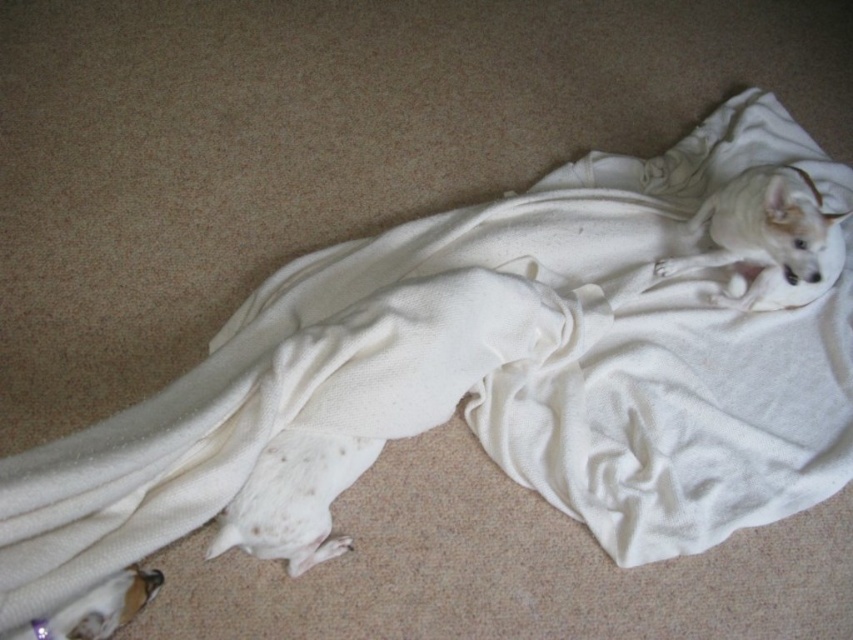
You are standing at the bottom left corner of the image. You need to locate the point at coordinates point (767,240). Which object is this point located on?

The point at coordinates point (767,240) is located on the white soft dog at upper right.

You are trying to locate the white soft dog at lower left in the image. According to the coordinates provided, where exactly is point [293,499] located in relation to the white soft dog at lower left?

Point [293,499] corresponds to the white soft dog at lower left.